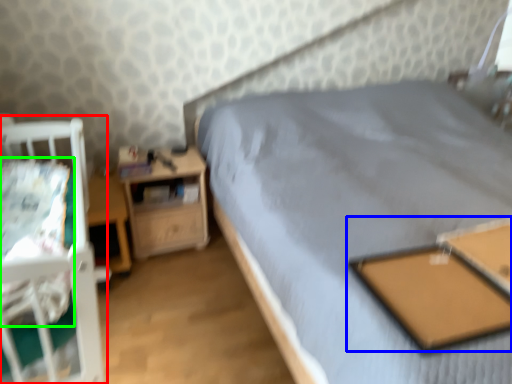
Question: Estimate the real-world distances between objects in this image. Which object is farther from infant bed (highlighted by a red box), table (highlighted by a blue box) or sheet (highlighted by a green box)?

Choices:
 (A) table
 (B) sheet

Answer: (A)